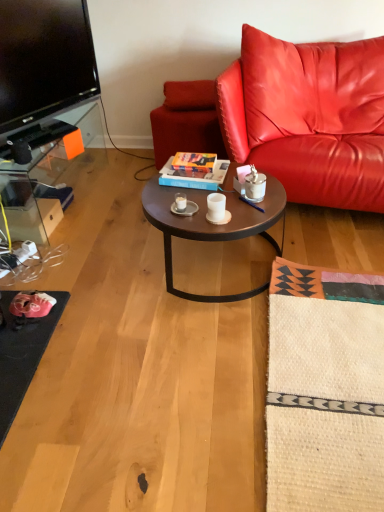
At what (x,y) coordinates should I click in order to perform the action: click on free space behind white ceramic mug at center, the 2th coffee cup from the front. Please return your answer as a coordinate pair (x, y). The image size is (384, 512). Looking at the image, I should click on (186, 194).